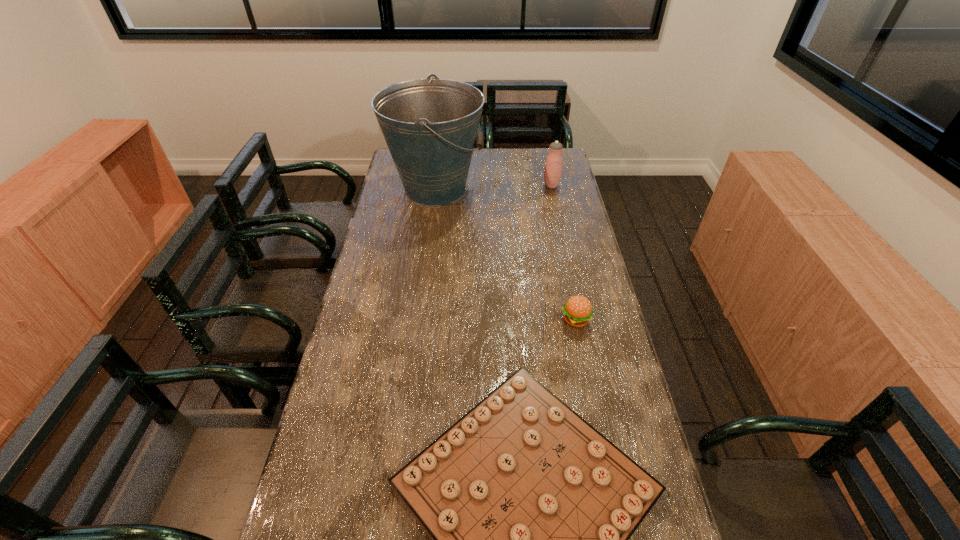
Locate an element on the screen. The image size is (960, 540). hamburger located in the right edge section of the desktop is located at coordinates (578, 311).

The image size is (960, 540). I want to click on object present at the far left corner, so click(x=430, y=126).

The width and height of the screenshot is (960, 540). I want to click on free space at the far edge of the desktop, so click(x=523, y=165).

Identify the location of free point at the left edge. This screenshot has height=540, width=960. (359, 307).

You are a GUI agent. You are given a task and a screenshot of the screen. Output one action in this format:
    pyautogui.click(x=<x>, y=<y>)
    Task: Click on the free region at the right edge of the desktop
    
    Given the screenshot: What is the action you would take?
    pyautogui.click(x=658, y=525)

Identify the location of blank region between the thermos bottle and the bucket. (493, 187).

Identify the location of empty location between the bucket and the third tallest object. The width and height of the screenshot is (960, 540). (506, 254).

In order to click on free space between the tallest object and the second shortest object in this screenshot , I will do `click(506, 254)`.

Image resolution: width=960 pixels, height=540 pixels. Find the location of `vacant area that lies between the hamburger and the bucket`. vacant area that lies between the hamburger and the bucket is located at coordinates (506, 254).

The height and width of the screenshot is (540, 960). Find the location of `vacant space that is in between the bucket and the thermos bottle`. vacant space that is in between the bucket and the thermos bottle is located at coordinates (493, 187).